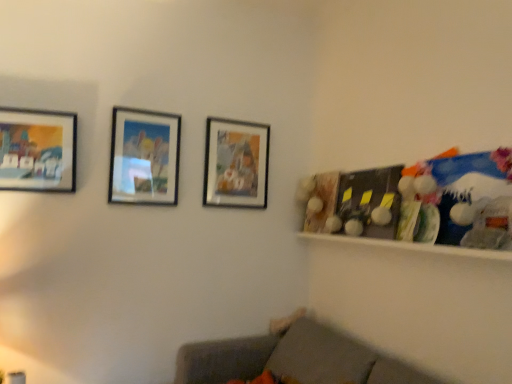
Question: Should I look upward or downward to see matte glass picture frame at center, which is counted as the second picture frame, starting from the left?

Choices:
 (A) up
 (B) down

Answer: (A)

Question: Is matte wooden picture frame at left, the first picture frame when ordered from left to right, bigger than gray fabric couch at lower center?

Choices:
 (A) no
 (B) yes

Answer: (A)

Question: From a real-world perspective, is matte wooden picture frame at left, the first picture frame when ordered from left to right, on top of gray fabric couch at lower center?

Choices:
 (A) yes
 (B) no

Answer: (A)

Question: Does matte wooden picture frame at left, the first picture frame when ordered from left to right, have a greater height compared to gray fabric couch at lower center?

Choices:
 (A) no
 (B) yes

Answer: (A)

Question: Is matte wooden picture frame at left, which is the first picture frame from front to back, far away from gray fabric couch at lower center?

Choices:
 (A) yes
 (B) no

Answer: (A)

Question: Does matte wooden picture frame at left, which is the 3th picture frame from right to left, appear on the right side of gray fabric couch at lower center?

Choices:
 (A) no
 (B) yes

Answer: (A)

Question: Is matte wooden picture frame at left, which is the first picture frame from front to back, smaller than gray fabric couch at lower center?

Choices:
 (A) no
 (B) yes

Answer: (B)

Question: Is gray fabric couch at lower center far from matte wooden picture frame at left, which appears as the third picture frame when viewed from the back?

Choices:
 (A) no
 (B) yes

Answer: (B)

Question: Could you tell me if gray fabric couch at lower center is facing matte wooden picture frame at left, the first picture frame when ordered from left to right?

Choices:
 (A) no
 (B) yes

Answer: (A)

Question: Is the position of gray fabric couch at lower center more distant than that of matte wooden picture frame at left, the first picture frame when ordered from left to right?

Choices:
 (A) yes
 (B) no

Answer: (B)

Question: From a real-world perspective, is gray fabric couch at lower center on top of matte wooden picture frame at left, which appears as the third picture frame when viewed from the back?

Choices:
 (A) no
 (B) yes

Answer: (A)

Question: Considering the relative sizes of gray fabric couch at lower center and matte wooden picture frame at left, the first picture frame when ordered from left to right, in the image provided, is gray fabric couch at lower center bigger than matte wooden picture frame at left, the first picture frame when ordered from left to right,?

Choices:
 (A) no
 (B) yes

Answer: (B)

Question: Is gray fabric couch at lower center outside of matte wooden picture frame at left, which is the 3th picture frame from right to left?

Choices:
 (A) yes
 (B) no

Answer: (A)

Question: Considering the relative sizes of matte wooden picture frame at center, which is counted as the 3th picture frame, starting from the front, and matte glass picture frame at center, which appears as the 2th picture frame when viewed from the back, in the image provided, is matte wooden picture frame at center, which is counted as the 3th picture frame, starting from the front, smaller than matte glass picture frame at center, which appears as the 2th picture frame when viewed from the back,?

Choices:
 (A) yes
 (B) no

Answer: (B)